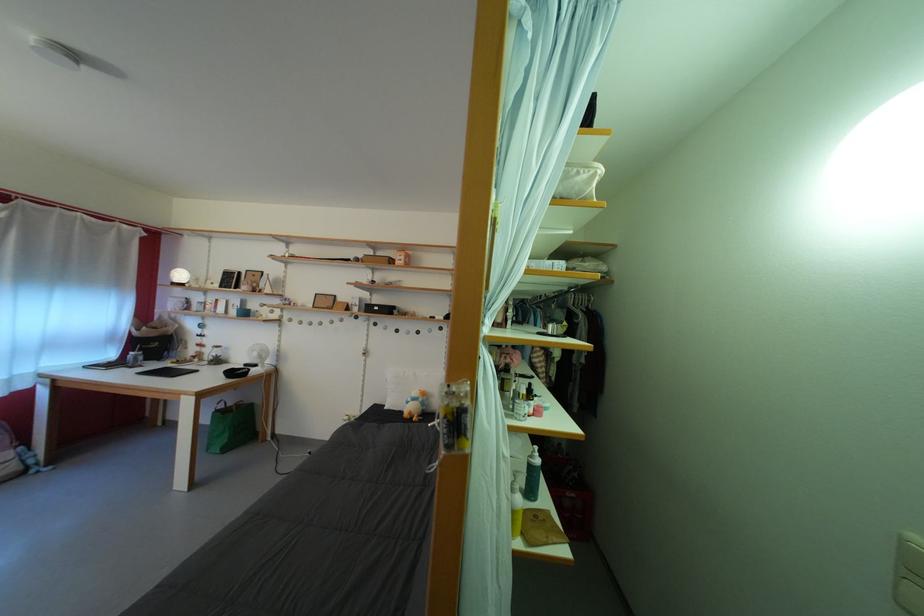
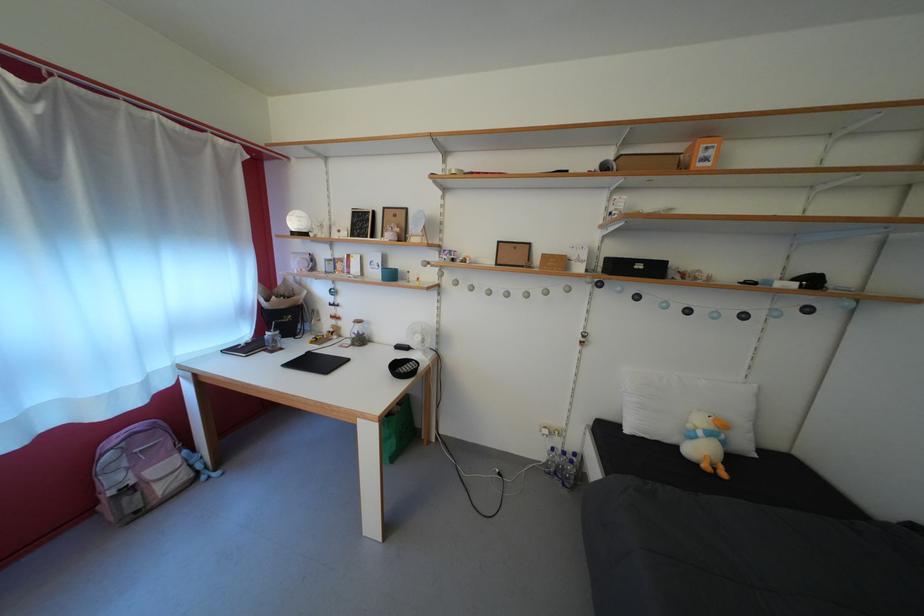
Where in the second image is the point corresponding to pixel 384 314 from the first image?

(648, 273)